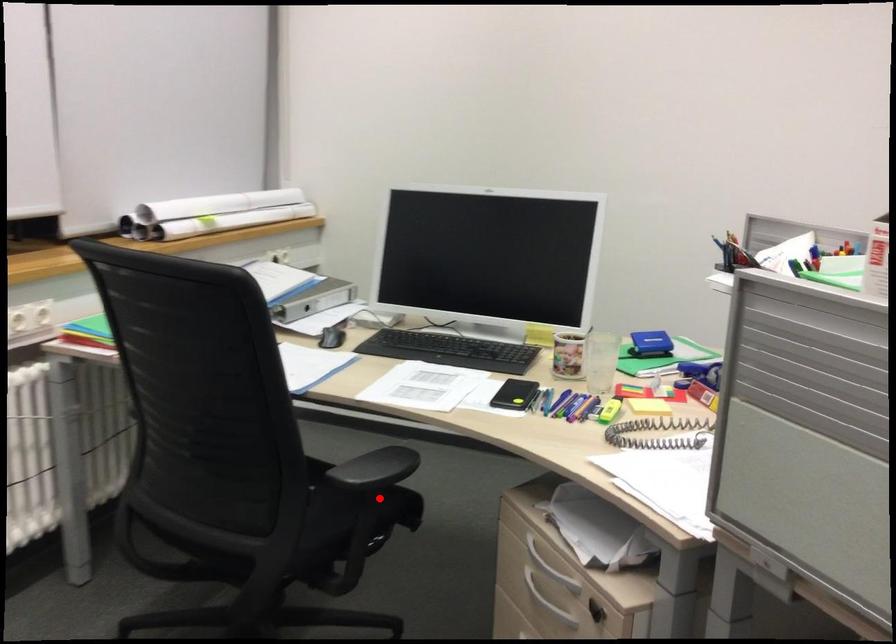
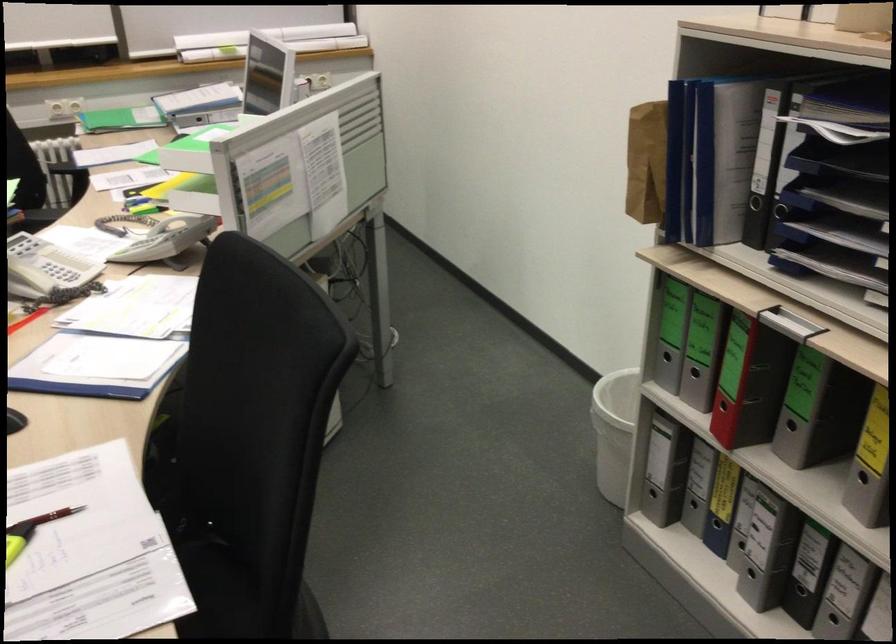
Question: I am providing you with two images of the same scene from different viewpoints. A red point is marked on the first image. Is the red point's position out of view in image 2?

Choices:
 (A) Yes
 (B) No

Answer: (A)